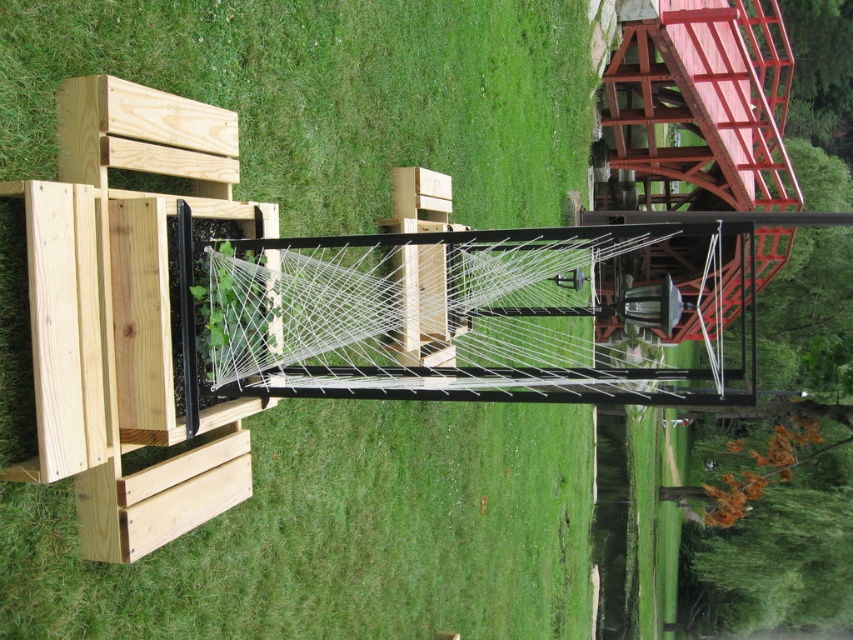
Between point (497, 499) and point (399, 268), which one is positioned in front?

Point (399, 268) is more forward.

Identify the location of green grass at center. (340, 534).

The width and height of the screenshot is (853, 640). What do you see at coordinates (340, 534) in the screenshot?
I see `green grass at center` at bounding box center [340, 534].

Find the location of `green grass at center`. green grass at center is located at coordinates (340, 534).